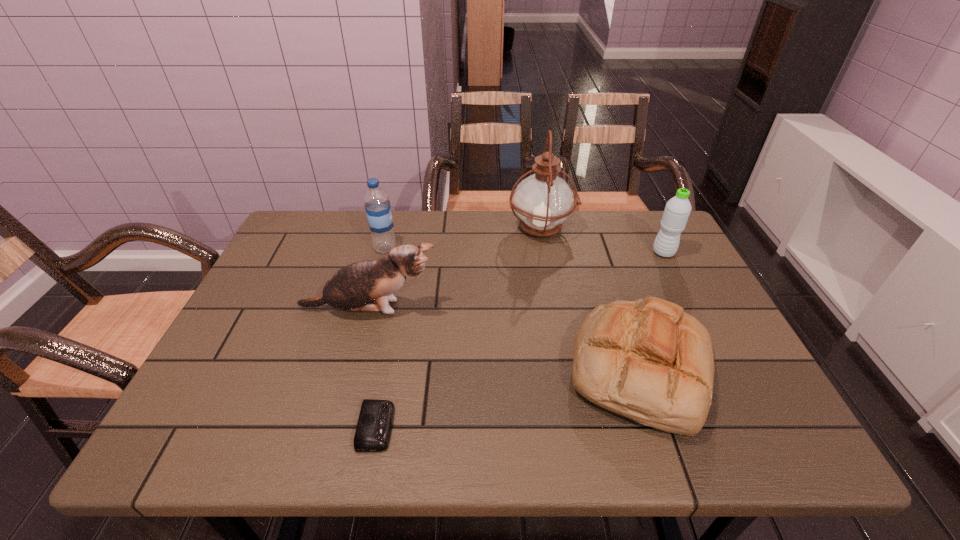
Identify the location of the tallest object. (543, 201).

Locate an element on the screen. the left water bottle is located at coordinates (377, 205).

What are the coordinates of `the right water bottle` in the screenshot? It's located at (677, 210).

What are the coordinates of `cat` in the screenshot? It's located at (352, 288).

Find the location of a particular element. the second shortest object is located at coordinates (647, 360).

Find the location of a particular element. This screenshot has width=960, height=540. alarm clock is located at coordinates (374, 426).

Identify the location of free space located on the front of the tallest object. (548, 260).

Identify the location of blank space located on the label of the left water bottle. (499, 248).

Image resolution: width=960 pixels, height=540 pixels. Find the location of `free space located 0.160m on the left of the right water bottle`. free space located 0.160m on the left of the right water bottle is located at coordinates (597, 253).

Where is `vacant point located 0.220m at the face of the cat`? The height and width of the screenshot is (540, 960). vacant point located 0.220m at the face of the cat is located at coordinates (526, 309).